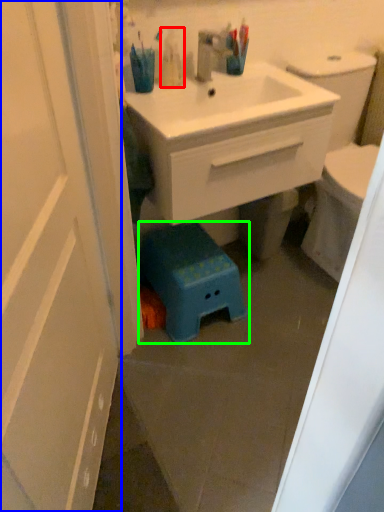
Question: Based on their relative distances, which object is nearer to toiletry (highlighted by a red box)? Choose from door (highlighted by a blue box) and step stool (highlighted by a green box).

Choices:
 (A) door
 (B) step stool

Answer: (B)